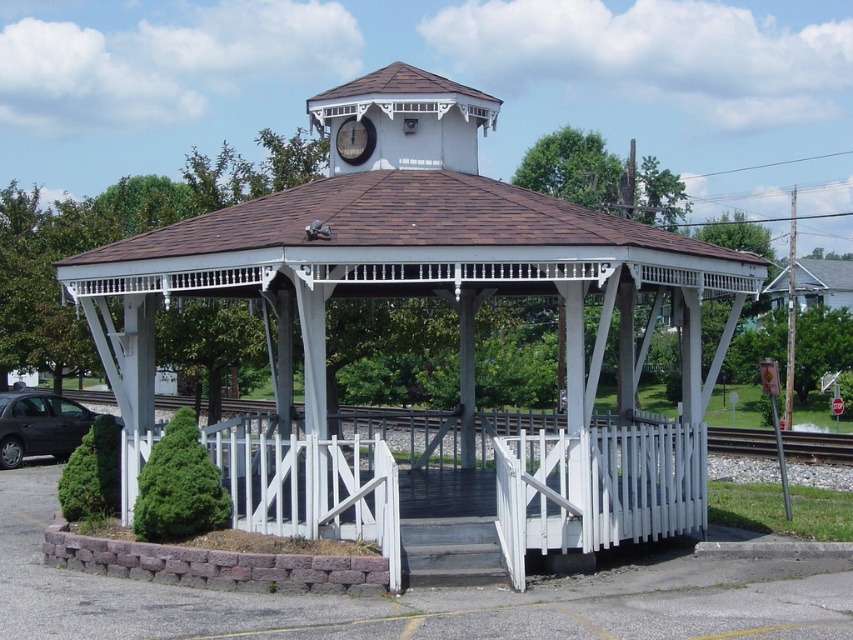
You are a toy train engineer who wants to drive your train from the bottom of the image to the gazebo. The train is on the white wooden train track at lower center. Can you drive the train up to the white wood gazebo at center?

The white wood gazebo at center is above the white wooden train track at lower center, so the train can drive up to the white wood gazebo at center since it is positioned higher than the track.

Looking at this image, you are standing in the park and see the white wood gazebo at center and the white wooden train track at lower center. Which object is nearer to you?

The white wood gazebo at center is closer to the viewer than the white wooden train track at lower center, so the gazebo is nearer to you.

You are standing at the entrance of the park and see the white wood gazebo at center and the matte black car at lower left. Which object appears taller from your perspective?

The white wood gazebo at center appears taller than the matte black car at lower left because it has a greater height compared to the matte black car at lower left.